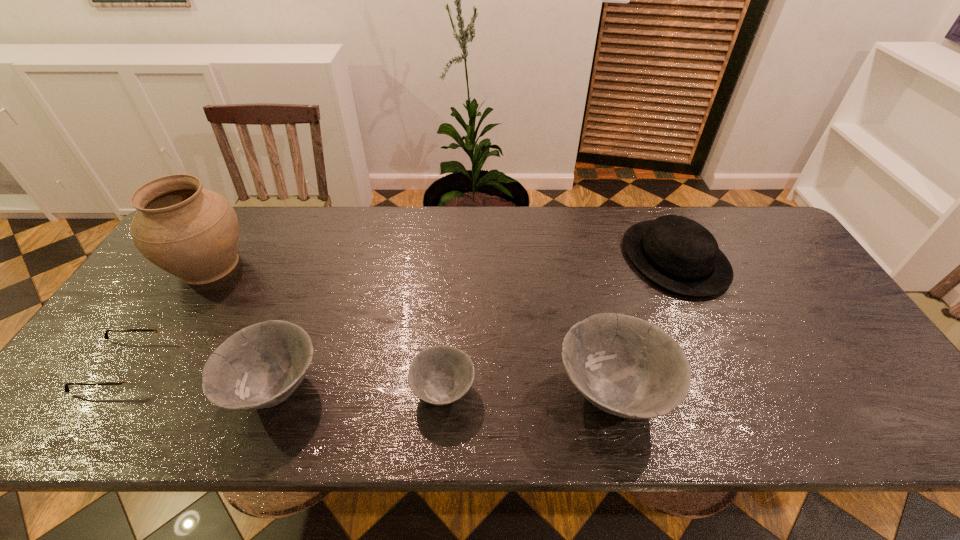
This screenshot has height=540, width=960. What are the coordinates of `the leftmost bowl` in the screenshot? It's located at (260, 366).

This screenshot has width=960, height=540. Find the location of `the second tallest bowl`. the second tallest bowl is located at coordinates (260, 366).

Find the location of a particular element. the shortest bowl is located at coordinates (439, 375).

Find the location of a particular element. the second shortest object is located at coordinates (439, 375).

Locate an element on the screen. the rightmost bowl is located at coordinates (626, 366).

Where is `the rightmost object`? Image resolution: width=960 pixels, height=540 pixels. the rightmost object is located at coordinates (677, 253).

Identify the location of urn. (192, 233).

Where is `spectacles`? Image resolution: width=960 pixels, height=540 pixels. spectacles is located at coordinates (136, 373).

Image resolution: width=960 pixels, height=540 pixels. Identify the location of free space located on the back of the second tallest bowl. (324, 254).

The height and width of the screenshot is (540, 960). Find the location of `vacant region located 0.070m on the back of the fifth tallest object`. vacant region located 0.070m on the back of the fifth tallest object is located at coordinates (446, 340).